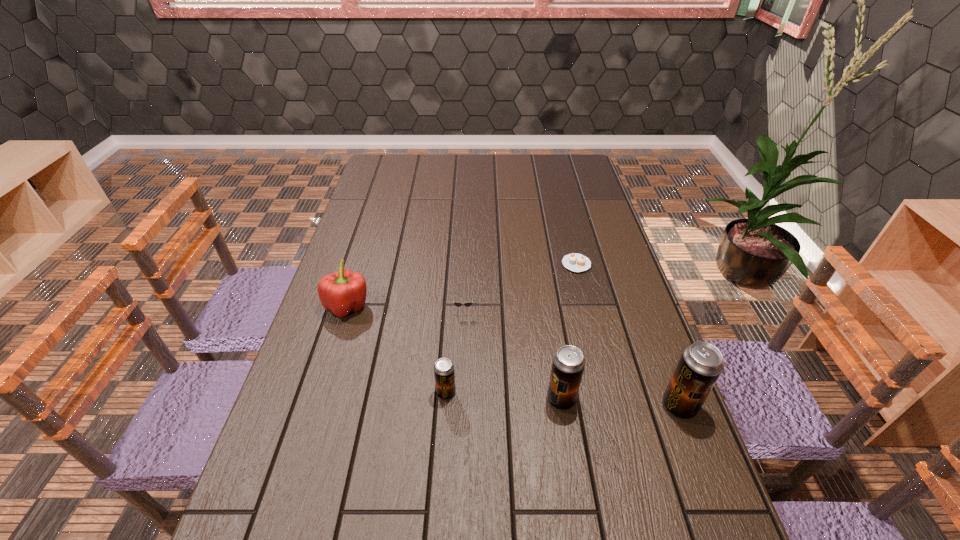
Locate an element on the screen. The height and width of the screenshot is (540, 960). the shortest beer can is located at coordinates (444, 374).

At what (x,y) coordinates should I click in order to perform the action: click on the third object from right to left. Please return your answer as a coordinate pair (x, y). This screenshot has height=540, width=960. Looking at the image, I should click on (568, 364).

This screenshot has height=540, width=960. I want to click on the second beer can from left to right, so (x=568, y=364).

Find the location of a particular element. The image size is (960, 540). the rightmost beer can is located at coordinates point(701,363).

This screenshot has height=540, width=960. In order to click on sunglasses in this screenshot , I will do `click(458, 304)`.

At what (x,y) coordinates should I click in order to perform the action: click on the leftmost object. Please return your answer as a coordinate pair (x, y). Looking at the image, I should click on (344, 291).

Locate an element on the screen. The image size is (960, 540). cupcake is located at coordinates (575, 262).

I want to click on the shortest object, so click(x=575, y=262).

Locate an element on the screen. vacant space located on the left of the leftmost beer can is located at coordinates (348, 393).

Locate an element on the screen. vacant space located on the front of the fifth shortest object is located at coordinates (578, 509).